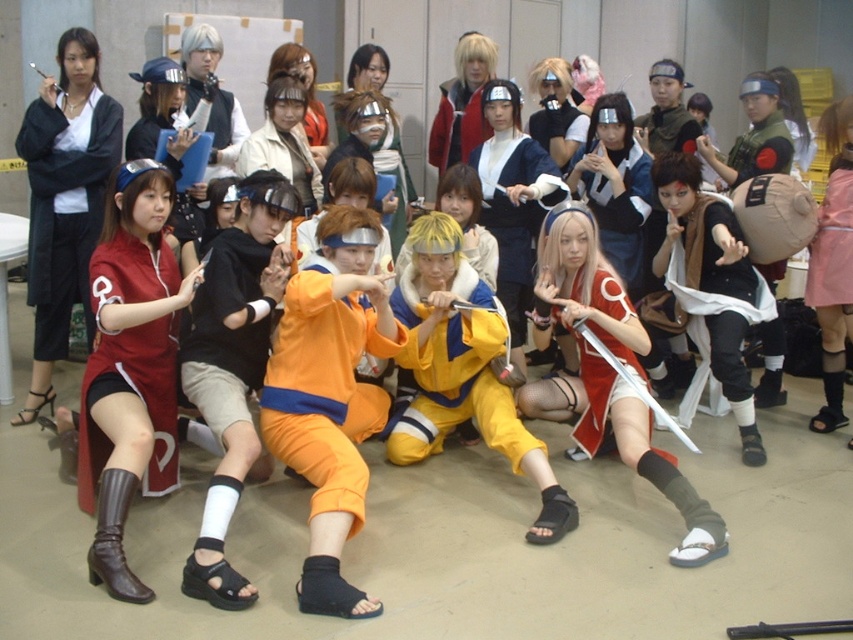
Question: Is matte black jacket at upper left in front of matte black jacket at center?

Choices:
 (A) no
 (B) yes

Answer: (B)

Question: Among these objects, which one is nearest to the camera?

Choices:
 (A) matte black jacket at center
 (B) pink fabric dress at center
 (C) orange fabric pants at center

Answer: (C)

Question: Which point is farther from the camera taking this photo?

Choices:
 (A) (389, 428)
 (B) (111, 266)

Answer: (A)

Question: Is matte black sword at center closer to camera compared to matte black jacket at center?

Choices:
 (A) no
 (B) yes

Answer: (B)

Question: Can you confirm if matte red cosplay outfit at left is bigger than yellow matte/soft fabric at center?

Choices:
 (A) yes
 (B) no

Answer: (B)

Question: Which of the following is the farthest from the observer?

Choices:
 (A) (403, 442)
 (B) (695, 294)

Answer: (B)